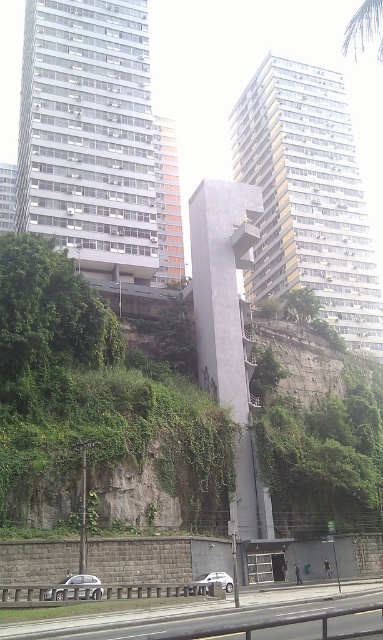
Is smooth asphalt highway at lower center to the right of white matte car at center from the viewer's perspective?

Yes, smooth asphalt highway at lower center is to the right of white matte car at center.

Who is shorter, smooth asphalt highway at lower center or white matte car at center?

With less height is white matte car at center.

Find the location of a particular element. The height and width of the screenshot is (640, 383). smooth asphalt highway at lower center is located at coordinates (194, 611).

Measure the distance from green leafy vegetation at center to white matte car at center.

A distance of 20.22 meters exists between green leafy vegetation at center and white matte car at center.

The width and height of the screenshot is (383, 640). What are the coordinates of `green leafy vegetation at center` in the screenshot? It's located at (96, 392).

Does point (150, 378) come in front of point (49, 588)?

No, (150, 378) is further to viewer.

How far apart are green leafy vegetation at center and silver metallic car at lower center?

green leafy vegetation at center is 22.02 meters away from silver metallic car at lower center.

Is point (18, 243) closer to viewer compared to point (99, 580)?

No, (18, 243) is further to viewer.

Locate an element on the screen. green leafy vegetation at center is located at coordinates coord(96,392).